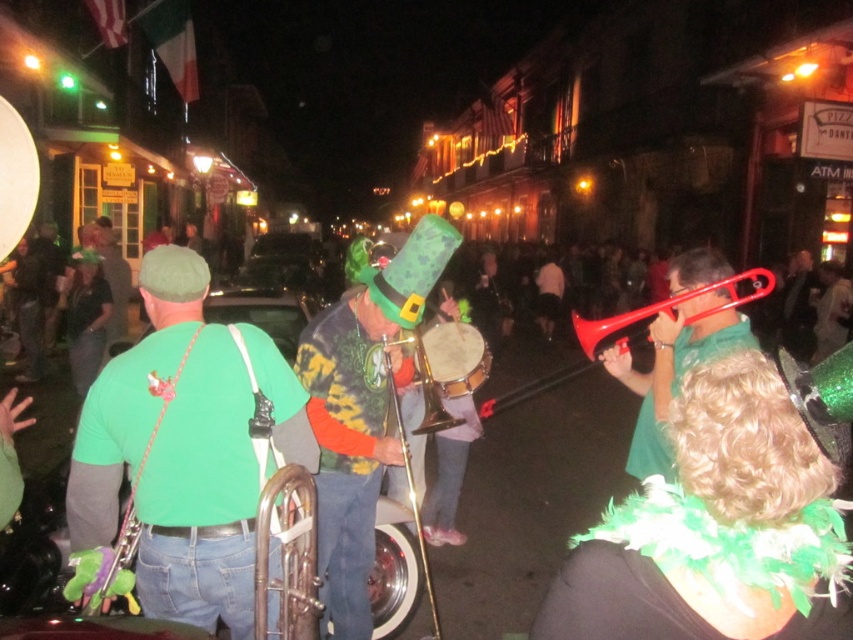
Does green matte t-shirt at center have a lesser width compared to brass shiny trumpet at center?

In fact, green matte t-shirt at center might be wider than brass shiny trumpet at center.

You are a GUI agent. You are given a task and a screenshot of the screen. Output one action in this format:
    pyautogui.click(x=<x>, y=<y>)
    Task: Click on the green matte t-shirt at center
    
    Given the screenshot: What is the action you would take?
    pyautogui.click(x=91, y=502)

Is point (80, 515) behind point (431, 429)?

That is False.

The image size is (853, 640). I want to click on green matte t-shirt at center, so click(91, 502).

Who is more distant from viewer, (657, 364) or (399, 348)?

Point (399, 348)

Between shiny red trumpet at center and brass shiny trumpet at center, which one appears on the right side from the viewer's perspective?

shiny red trumpet at center is more to the right.

Is point (630, 378) positioned in front of point (410, 333)?

That is False.

The image size is (853, 640). What are the coordinates of `shiny red trumpet at center` in the screenshot? It's located at tap(672, 369).

Does red plastic trumpet at center right appear on the right side of green matte hat at upper center?

Correct, you'll find red plastic trumpet at center right to the right of green matte hat at upper center.

Which is behind, point (514, 397) or point (131, 289)?

Positioned behind is point (131, 289).

Which is behind, point (486, 403) or point (96, 234)?

Point (96, 234)

Locate an element on the screen. This screenshot has width=853, height=640. red plastic trumpet at center right is located at coordinates (631, 332).